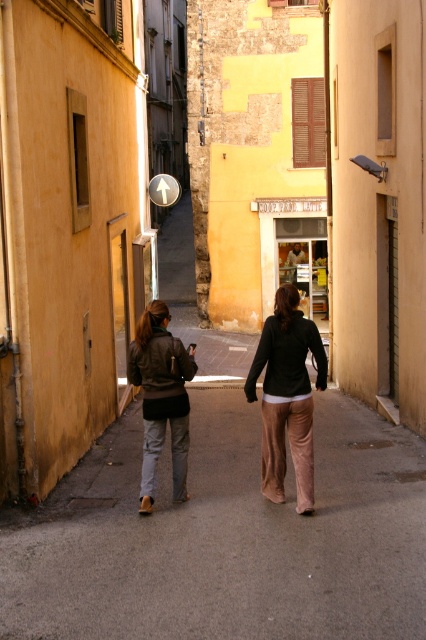
Question: Can you confirm if smooth concrete pavement at center is positioned above leather jacket at center?

Choices:
 (A) yes
 (B) no

Answer: (B)

Question: Among these points, which one is nearest to the camera?

Choices:
 (A) (302, 417)
 (B) (293, 428)
 (C) (127, 353)
 (D) (192, 444)

Answer: (A)

Question: Which object is closer to the camera taking this photo?

Choices:
 (A) leather jacket at center
 (B) smooth concrete pavement at center

Answer: (B)

Question: Does leather jacket at center have a lesser width compared to matte brown jacket at center?

Choices:
 (A) no
 (B) yes

Answer: (A)

Question: Which of these objects is positioned closest to the leather jacket at center?

Choices:
 (A) matte brown jacket at center
 (B) matte black jacket at center

Answer: (B)

Question: Is smooth concrete pavement at center further to the viewer compared to matte black jacket at center?

Choices:
 (A) no
 (B) yes

Answer: (A)